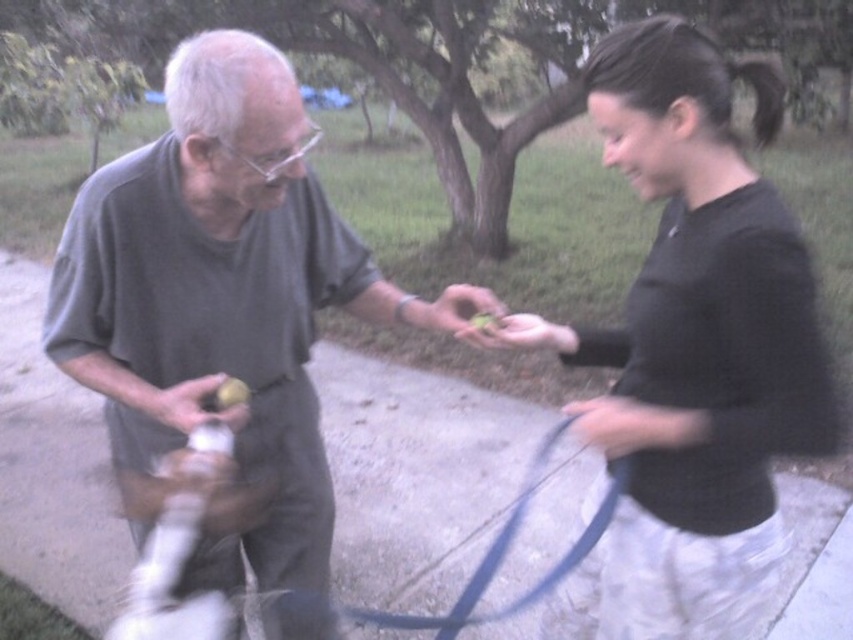
Based on the photo, you are a delivery person who needs to place a package between the smooth green apple at center and the yellow matte apple at center. The package requires 20 inches of space. Can you fit it there?

The distance between the smooth green apple at center and the yellow matte apple at center is 18.42 inches, which is less than the required 20 inches. Therefore, the package cannot be placed there.

You are standing in the garden and see the white fur dog at lower left. If you want to approach the dog, which direction should you move relative to your current position?

To approach the white fur dog at lower left, you should move towards the lower left direction from your current position.

You are a photographer trying to capture a closeup shot of the white matte food at center. The white fur dog at lower left is blocking your view. How can you adjust your position to ensure the dog is no longer in the frame?

Since the white fur dog at lower left is wider than the white matte food at center, you should move to the side opposite of the dog to position yourself where the dog is no longer blocking the view of the white matte food at center.